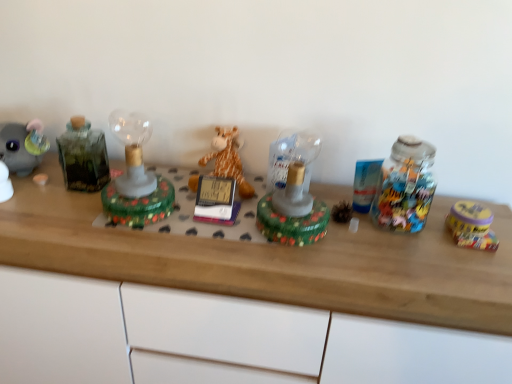
Where is `vacant region in front of translucent glass lamp at center, the 2th toy positioned from the right`? The image size is (512, 384). vacant region in front of translucent glass lamp at center, the 2th toy positioned from the right is located at coordinates 303,266.